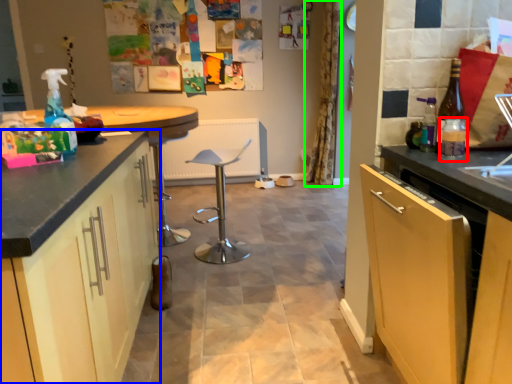
Question: Estimate the real-world distances between objects in this image. Which object is closer to bottle (highlighted by a red box), cabinetry (highlighted by a blue box) or curtain (highlighted by a green box)?

Choices:
 (A) cabinetry
 (B) curtain

Answer: (A)